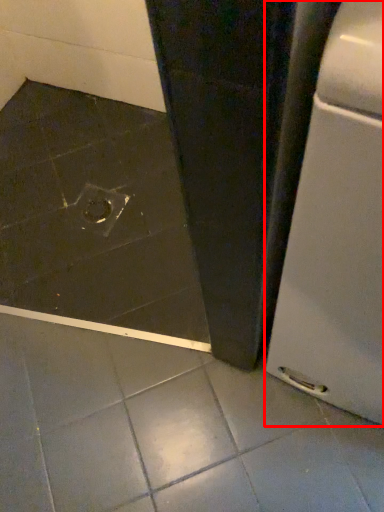
Question: From the image's perspective, what is the correct spatial relationship of home appliance (annotated by the red box) in relation to drain?

Choices:
 (A) above
 (B) below

Answer: (B)